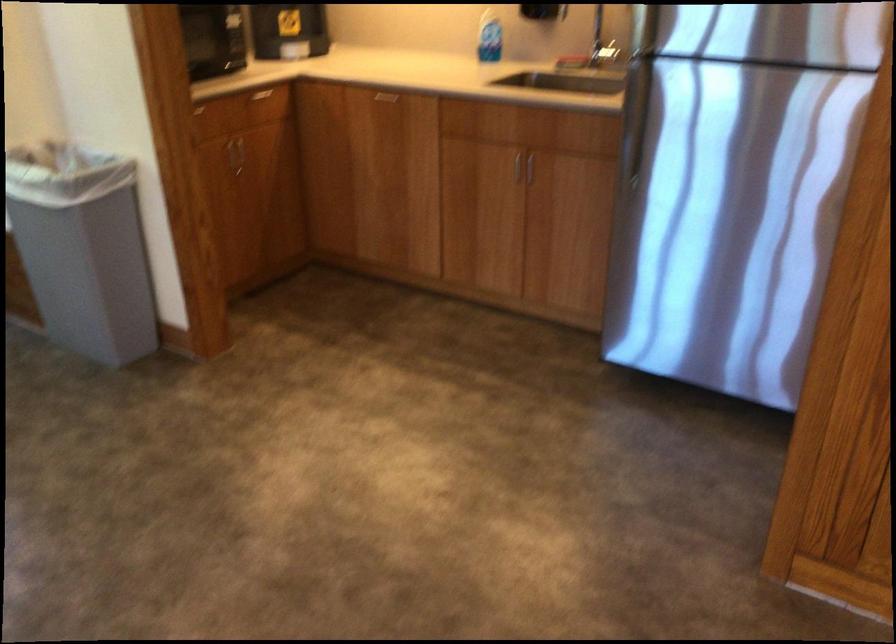
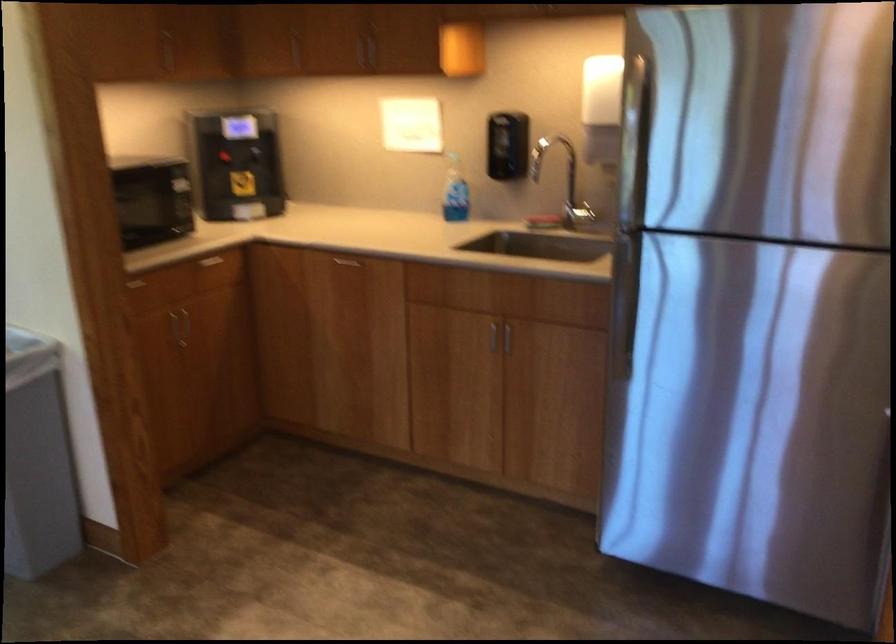
Question: How did the camera likely rotate?

Choices:
 (A) Left
 (B) Right
 (C) Up
 (D) Down

Answer: (C)